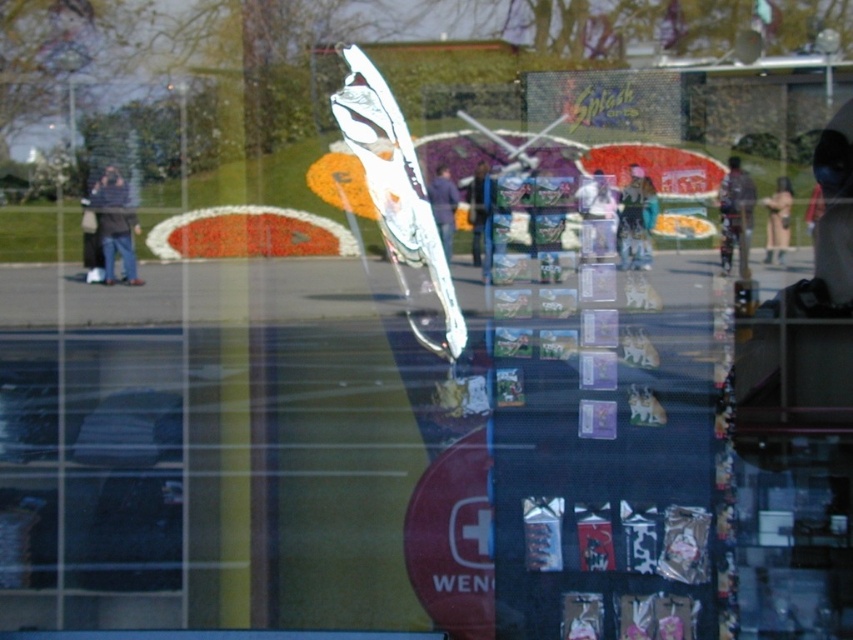
Question: Which object is closer to the camera taking this photo?

Choices:
 (A) light brown leather jacket at right
 (B) matte black jacket at left

Answer: (A)

Question: Is light brown leather jacket at right closer to the viewer compared to dark blue jeans at center?

Choices:
 (A) no
 (B) yes

Answer: (B)

Question: Estimate the real-world distances between objects in this image. Which object is farther from the matte black jacket at left?

Choices:
 (A) light brown leather jacket at right
 (B) dark blue jeans at left
 (C) blue denim jeans at center

Answer: (A)

Question: Can you confirm if camouflage jacket at right is positioned above dark blue jeans at left?

Choices:
 (A) no
 (B) yes

Answer: (B)

Question: Does dark blue jeans at center have a greater width compared to blue denim jeans at center?

Choices:
 (A) yes
 (B) no

Answer: (A)

Question: Which object is farther from the camera taking this photo?

Choices:
 (A) matte black jacket at left
 (B) light brown leather jacket at right
 (C) blue denim jeans at center

Answer: (A)